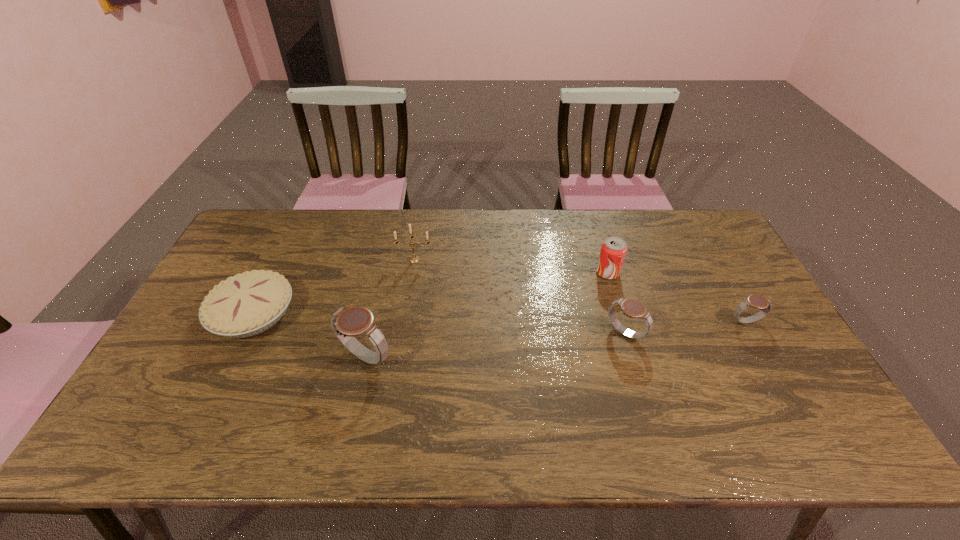
Locate an element on the screen. This screenshot has width=960, height=540. vacant area that lies between the shortest watch and the farthest object is located at coordinates (580, 291).

I want to click on blank region between the candle and the second tallest watch, so click(519, 297).

At what (x,y) coordinates should I click in order to perform the action: click on vacant point located between the soda can and the pie. Please return your answer as a coordinate pair (x, y). Image resolution: width=960 pixels, height=540 pixels. Looking at the image, I should click on click(430, 293).

Where is `free space between the tallest watch and the farthest object`? This screenshot has height=540, width=960. free space between the tallest watch and the farthest object is located at coordinates (390, 308).

You are a GUI agent. You are given a task and a screenshot of the screen. Output one action in this format:
    pyautogui.click(x=<x>, y=<y>)
    Task: Click on the free space between the shortest watch and the tallest watch
    
    Given the screenshot: What is the action you would take?
    pyautogui.click(x=556, y=340)

You are a GUI agent. You are given a task and a screenshot of the screen. Output one action in this format:
    pyautogui.click(x=<x>, y=<y>)
    Task: Click on the free spot between the rightmost object and the candle
    The height and width of the screenshot is (540, 960).
    Given the screenshot: What is the action you would take?
    pyautogui.click(x=580, y=291)

Image resolution: width=960 pixels, height=540 pixels. Identify the location of vacant region between the fifth nearest object and the rightmost watch. (677, 298).

Find the location of a particular element. This screenshot has height=540, width=960. free area in between the pie and the rightmost watch is located at coordinates (499, 318).

Where is `unoccupied position between the second watch from left to right and the farthest object`? Image resolution: width=960 pixels, height=540 pixels. unoccupied position between the second watch from left to right and the farthest object is located at coordinates (519, 297).

Select which object is the closest to the fifth nearest object. Please provide its 2D coordinates. Your answer should be formatted as a tuple, i.e. [(x, y)], where the tuple contains the x and y coordinates of a point satisfying the conditions above.

[(632, 308)]